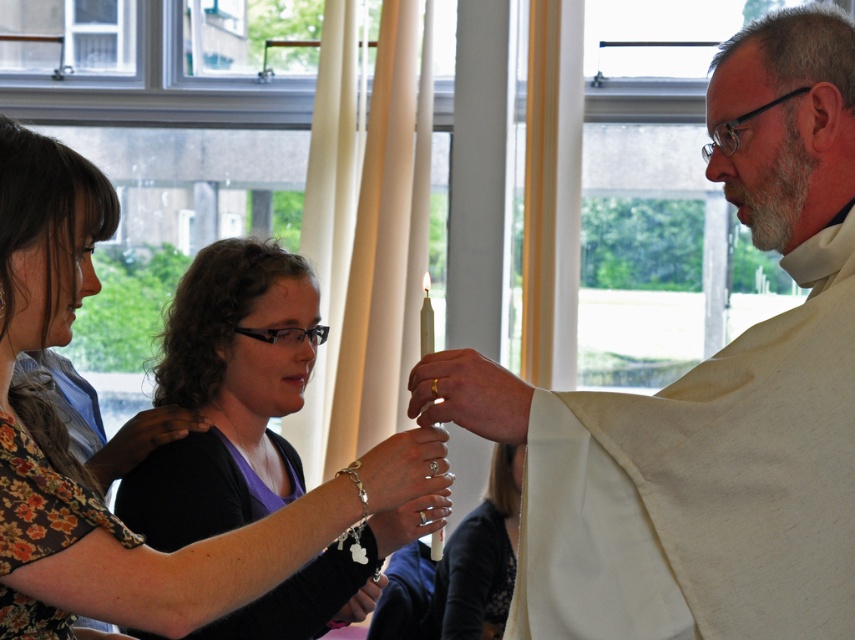
You are a photographer standing 1.5 meters away from the white clothed man at center. You want to take a photo of the white matte robe at center. Can you reach the robe without moving closer than 1.5 meters?

The distance between the white clothed man at center and the white matte robe at center is 2.07 meters. Since you are already 1.5 meters away from the man, the robe is an additional 2.07 meters beyond him. Therefore, you need to move closer to reach it within 1.5 meters.

You are standing in the church and need to pass between the white clothed man at center and the silver metallic bracelet at lower center. Can you walk through the space between them without bending down?

The white clothed man at center is much taller than the silver metallic bracelet at lower center, so the space between them is likely sufficient for a person to walk through without bending down.

You are standing in the church and want to hand a flower to the white clothed man at center and the silver metallic bracelet at lower center. Which one should you approach first?

You should approach the white clothed man at center first because he is closer to you than the silver metallic bracelet at lower center.